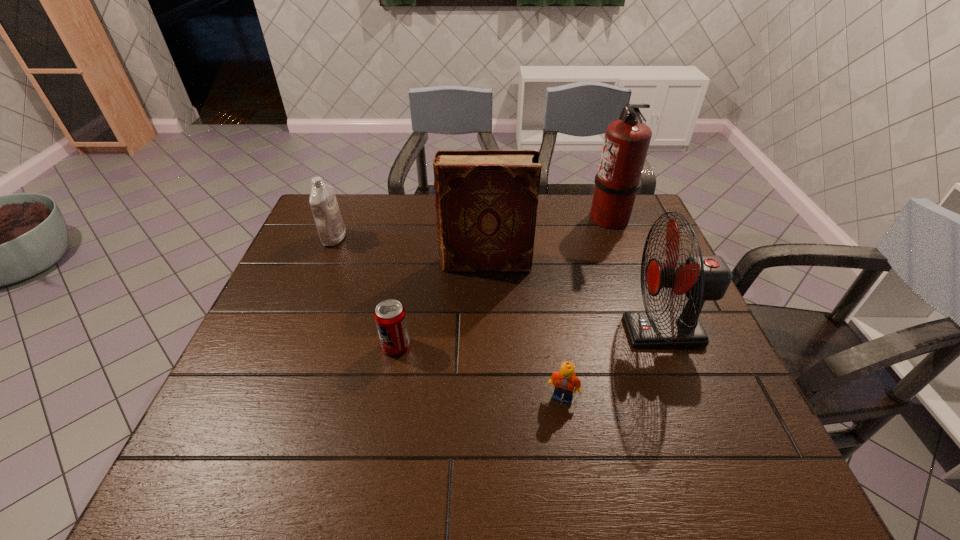
Locate an element on the screen. This screenshot has width=960, height=540. fire extinguisher is located at coordinates 626,142.

The height and width of the screenshot is (540, 960). In order to click on the third farthest object in this screenshot , I will do `click(486, 203)`.

Locate an element on the screen. fan is located at coordinates (702, 278).

This screenshot has height=540, width=960. I want to click on detergent, so 331,228.

Locate an element on the screen. the leftmost object is located at coordinates (331, 228).

The image size is (960, 540). Identify the location of the second object from left to right. (390, 317).

Locate an element on the screen. the nearest object is located at coordinates (564, 381).

The image size is (960, 540). I want to click on vacant area situated toward the nozzle of the fire extinguisher, so click(x=486, y=217).

Locate an element on the screen. free space located toward the nozzle of the fire extinguisher is located at coordinates (543, 217).

Where is `free location located 0.070m toward the nozzle of the fire extinguisher`? This screenshot has width=960, height=540. free location located 0.070m toward the nozzle of the fire extinguisher is located at coordinates (567, 217).